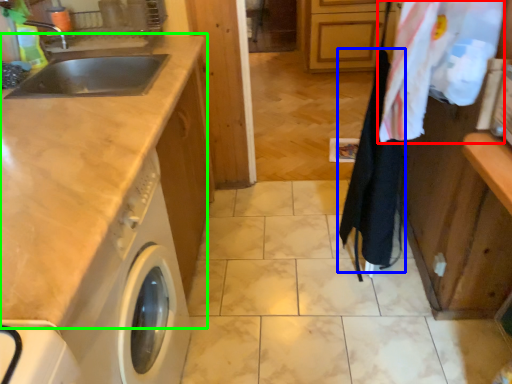
Question: Considering the real-world distances, which object is farthest from laundry (highlighted by a red box)? clothesline (highlighted by a blue box) or countertop (highlighted by a green box)?

Choices:
 (A) clothesline
 (B) countertop

Answer: (B)